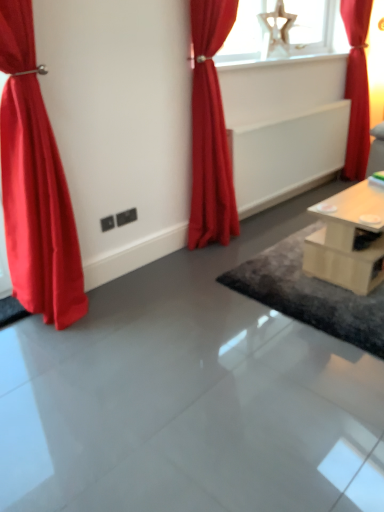
Where is `vacant space in front of matte red curtain at center, acting as the second curtain starting from the front`? This screenshot has width=384, height=512. vacant space in front of matte red curtain at center, acting as the second curtain starting from the front is located at coordinates (214, 260).